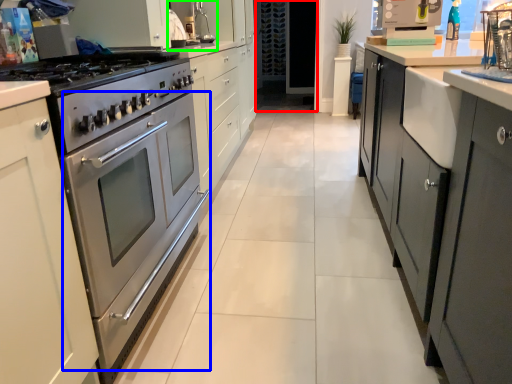
Question: Estimate the real-world distances between objects in this image. Which object is closer to glass door (highlighted by a red box), oven (highlighted by a blue box) or sink (highlighted by a green box)?

Choices:
 (A) oven
 (B) sink

Answer: (B)